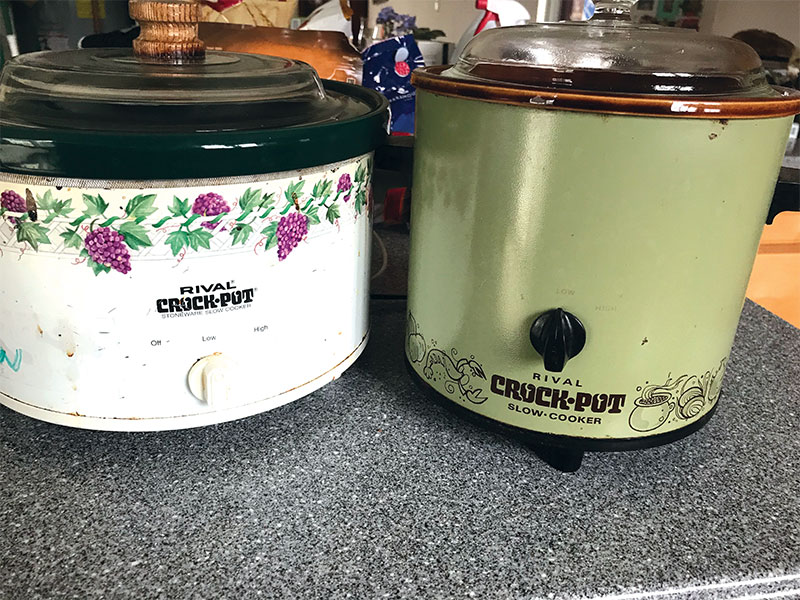
Find the location of a particular element. This screenshot has height=600, width=800. spray bottle is located at coordinates (510, 6).